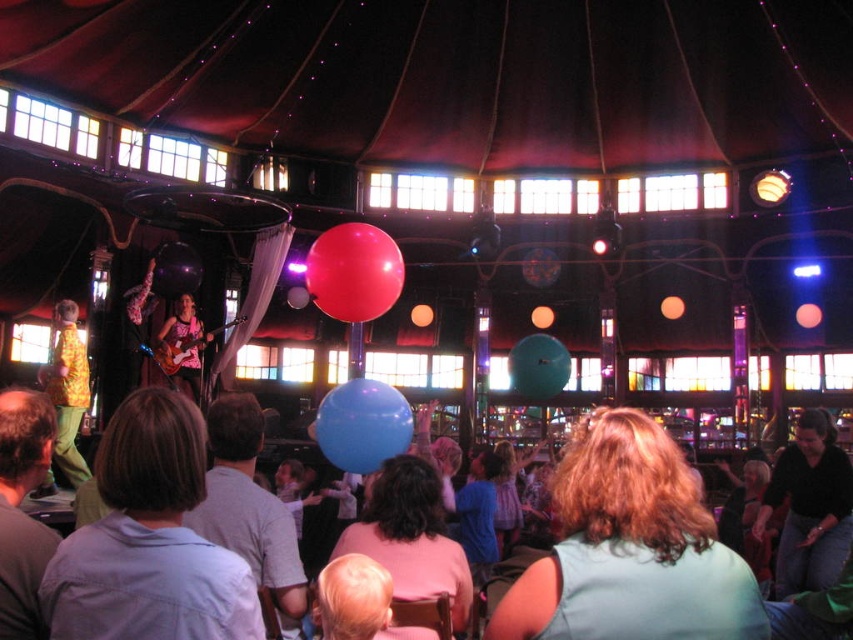
Is point (776, 460) positioned in front of point (363, 436)?

No, it is behind (363, 436).

Does black cotton shirt at lower right have a smaller size compared to blue rubber balloon at center?

Actually, black cotton shirt at lower right might be larger than blue rubber balloon at center.

What do you see at coordinates (809, 506) in the screenshot? I see `black cotton shirt at lower right` at bounding box center [809, 506].

I want to click on black cotton shirt at lower right, so click(809, 506).

Is black cotton shirt at lower right shorter than matte pink guitar at center?

In fact, black cotton shirt at lower right may be taller than matte pink guitar at center.

The width and height of the screenshot is (853, 640). What do you see at coordinates (809, 506) in the screenshot?
I see `black cotton shirt at lower right` at bounding box center [809, 506].

This screenshot has height=640, width=853. I want to click on black cotton shirt at lower right, so pos(809,506).

Which is more to the left, rubber balloon at center or translucent blue balloon at center?

Positioned to the left is rubber balloon at center.

Is point (373, 230) positioned behind point (511, 352)?

That is False.

Where is `rubber balloon at center`? rubber balloon at center is located at coordinates (354, 272).